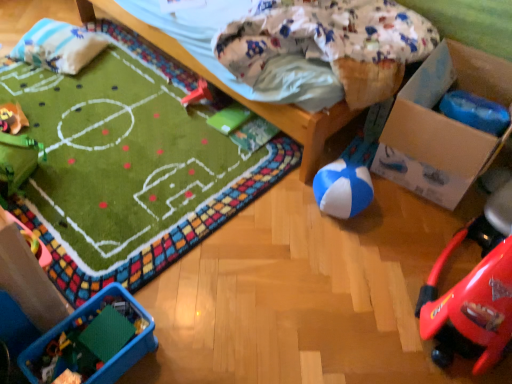
Question: From a real-world perspective, is plush yellow duck at upper left, positioned as the 2th toy in top-to-bottom order, over white soft pillow at upper left?

Choices:
 (A) yes
 (B) no

Answer: (B)

Question: Is plush yellow duck at upper left, positioned as the 2th toy in top-to-bottom order, wider than white soft pillow at upper left?

Choices:
 (A) yes
 (B) no

Answer: (B)

Question: Is there a large distance between plush yellow duck at upper left, which is the first toy in left-to-right order, and white soft pillow at upper left?

Choices:
 (A) yes
 (B) no

Answer: (B)

Question: Is plush yellow duck at upper left, acting as the 3th toy starting from the bottom, thinner than white soft pillow at upper left?

Choices:
 (A) yes
 (B) no

Answer: (A)

Question: Considering the relative positions of plush yellow duck at upper left, positioned as the 2th toy in top-to-bottom order, and white soft pillow at upper left in the image provided, is plush yellow duck at upper left, positioned as the 2th toy in top-to-bottom order, to the left of white soft pillow at upper left from the viewer's perspective?

Choices:
 (A) yes
 (B) no

Answer: (A)

Question: Is blue/white rubber ball at center-right, the third toy from the back, wider or thinner than translucent plastic container at lower left, the fourth toy viewed from the back?

Choices:
 (A) wide
 (B) thin

Answer: (B)

Question: Is point (360, 142) positioned closer to the camera than point (114, 375)?

Choices:
 (A) closer
 (B) farther

Answer: (B)

Question: Considering their positions, is blue/white rubber ball at center-right, the second toy viewed from the front, located in front of or behind translucent plastic container at lower left, placed as the first toy when sorted from front to back?

Choices:
 (A) front
 (B) behind

Answer: (B)

Question: From a real-world perspective, is blue/white rubber ball at center-right, which ranks as the 3th toy in top-to-bottom order, physically located above or below translucent plastic container at lower left, the 2th toy from the left?

Choices:
 (A) below
 (B) above

Answer: (B)

Question: Is blue/white rubber ball at center-right, the second toy viewed from the front, taller or shorter than rubberized red car at center, which ranks as the first toy in top-to-bottom order?

Choices:
 (A) tall
 (B) short

Answer: (A)

Question: From a real-world perspective, relative to rubberized red car at center, arranged as the first toy when viewed from the back, is blue/white rubber ball at center-right, the second toy viewed from the front, vertically above or below?

Choices:
 (A) above
 (B) below

Answer: (A)

Question: From the image's perspective, is blue/white rubber ball at center-right, arranged as the 1th toy when viewed from the right, located above or below rubberized red car at center, acting as the 3th toy starting from the left?

Choices:
 (A) below
 (B) above

Answer: (A)

Question: Would you say blue/white rubber ball at center-right, the second toy viewed from the front, is to the left or to the right of rubberized red car at center, marked as the 4th toy in a bottom-to-top arrangement, in the picture?

Choices:
 (A) left
 (B) right

Answer: (B)

Question: Is translucent plastic container at lower left, positioned as the 1th toy in bottom-to-top order, bigger or smaller than rubberized red car at center, which ranks as the first toy in top-to-bottom order?

Choices:
 (A) big
 (B) small

Answer: (A)

Question: Does point (106, 377) appear closer or farther from the camera than point (190, 91)?

Choices:
 (A) farther
 (B) closer

Answer: (B)